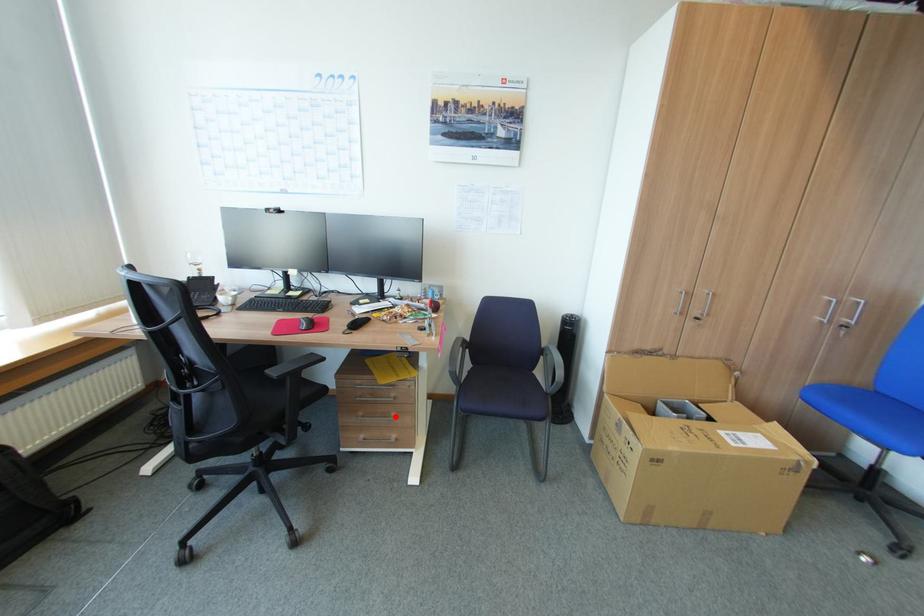
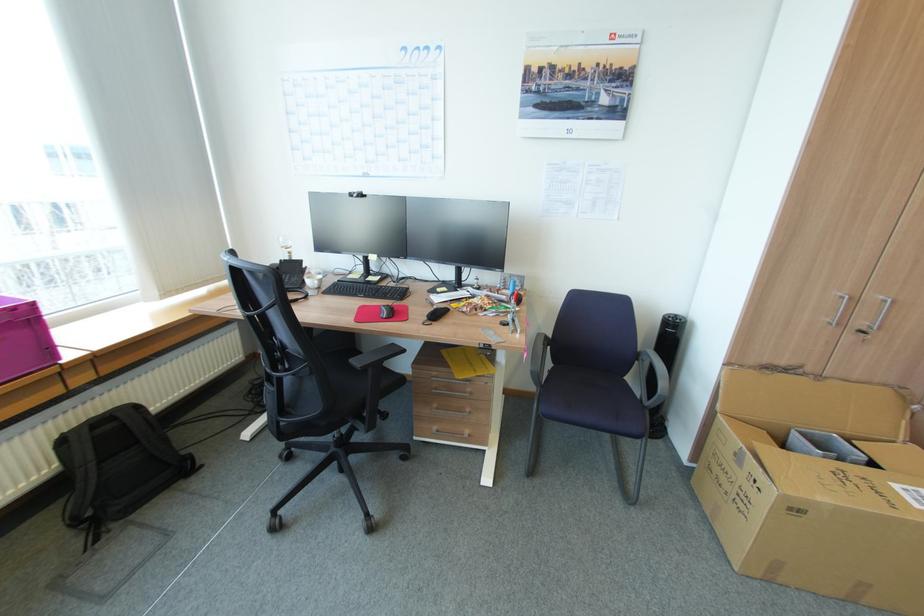
Where in the second image is the point corresponding to the highlighted location from the first image?

(468, 411)